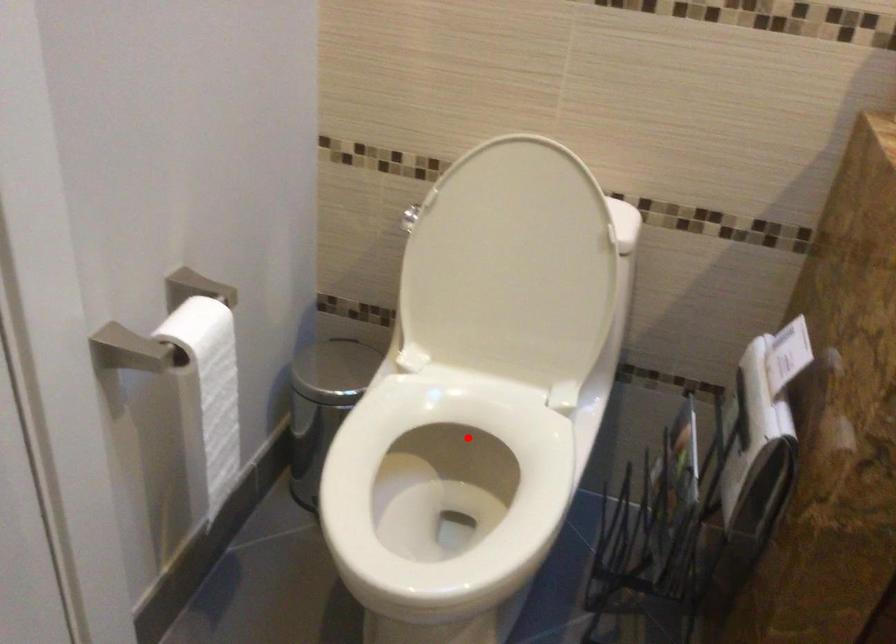
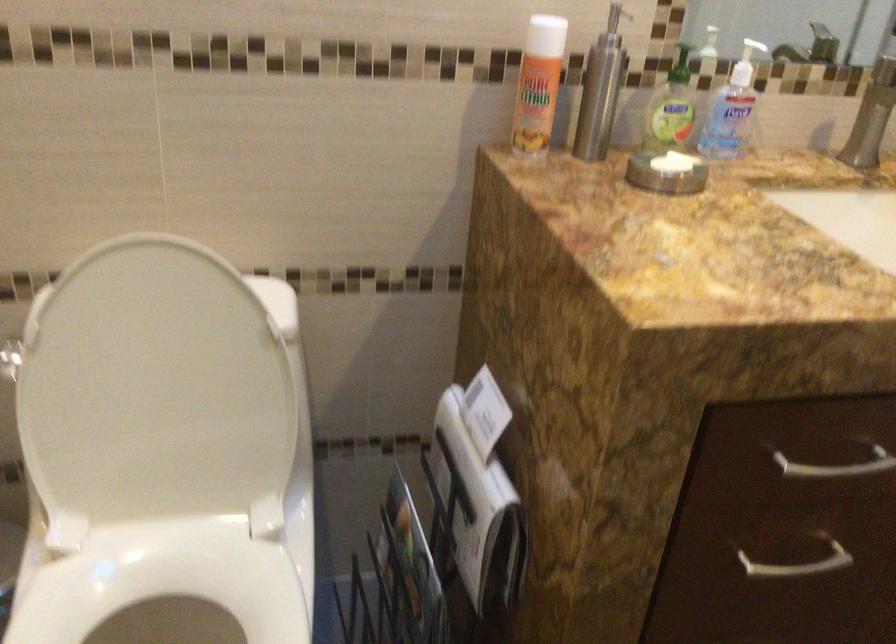
In the second image, find the point that corresponds to the highlighted location in the first image.

(166, 594)